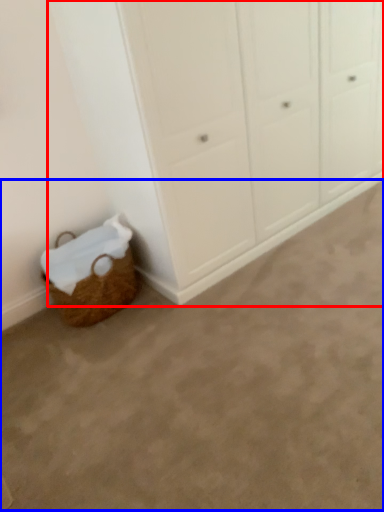
Question: Which object is closer to the camera taking this photo, cupboard (highlighted by a red box) or plain (highlighted by a blue box)?

Choices:
 (A) cupboard
 (B) plain

Answer: (B)